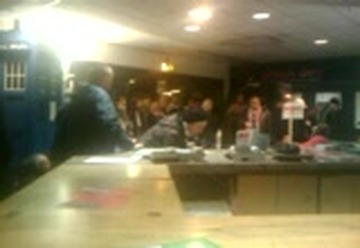
Locate an element on the screen. The height and width of the screenshot is (248, 360). table top is located at coordinates (167, 198), (219, 159).